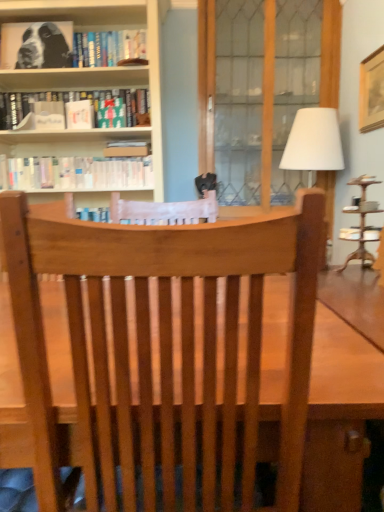
Question: Is wooden picture frame at upper right inside white matte book at upper center?

Choices:
 (A) yes
 (B) no

Answer: (B)

Question: Does white matte book at upper center have a greater height compared to wooden picture frame at upper right?

Choices:
 (A) yes
 (B) no

Answer: (B)

Question: Does white matte book at upper center have a greater width compared to wooden picture frame at upper right?

Choices:
 (A) yes
 (B) no

Answer: (A)

Question: Is white matte book at upper center at the right side of wooden picture frame at upper right?

Choices:
 (A) no
 (B) yes

Answer: (A)

Question: From a real-world perspective, does white matte book at upper center sit lower than wooden picture frame at upper right?

Choices:
 (A) yes
 (B) no

Answer: (A)

Question: Relative to wooden screen door at center, is wooden picture frame at upper right in front or behind?

Choices:
 (A) front
 (B) behind

Answer: (A)

Question: Is point (377, 93) closer or farther from the camera than point (243, 109)?

Choices:
 (A) closer
 (B) farther

Answer: (A)

Question: Is wooden picture frame at upper right inside the boundaries of wooden screen door at center, or outside?

Choices:
 (A) inside
 (B) outside

Answer: (B)

Question: Is wooden picture frame at upper right to the left or to the right of wooden screen door at center in the image?

Choices:
 (A) right
 (B) left

Answer: (A)

Question: In terms of size, does white paperbacks at upper left, the 1th book ordered from the bottom, appear bigger or smaller than white fabric lampshade at right?

Choices:
 (A) small
 (B) big

Answer: (A)

Question: Is white paperbacks at upper left, the 3th book when ordered from top to bottom, inside the boundaries of white fabric lampshade at right, or outside?

Choices:
 (A) outside
 (B) inside

Answer: (A)

Question: From a real-world perspective, relative to white fabric lampshade at right, is white paperbacks at upper left, the 1th book ordered from the bottom, vertically above or below?

Choices:
 (A) above
 (B) below

Answer: (A)

Question: From the image's perspective, is white paperbacks at upper left, the 1th book ordered from the bottom, positioned above or below white fabric lampshade at right?

Choices:
 (A) below
 (B) above

Answer: (B)

Question: Does point (92, 91) appear closer or farther from the camera than point (119, 58)?

Choices:
 (A) closer
 (B) farther

Answer: (B)

Question: From a real-world perspective, is hardcover book at upper left, arranged as the 2th book when viewed from the top, physically located above or below black and white print at upper left, acting as the third book starting from the bottom?

Choices:
 (A) below
 (B) above

Answer: (A)